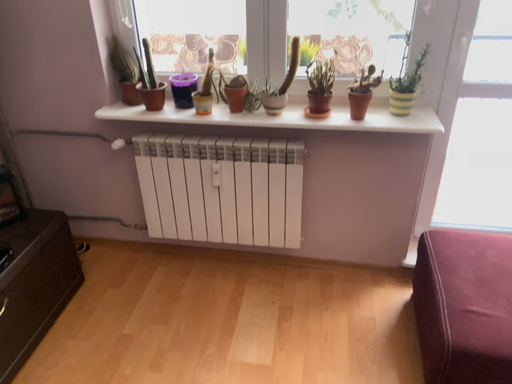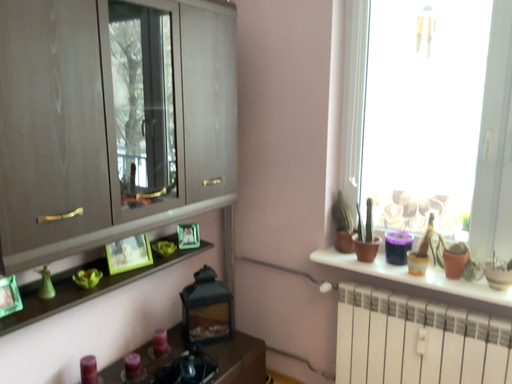
Question: How did the camera likely rotate when shooting the video?

Choices:
 (A) rotated left
 (B) rotated right

Answer: (A)